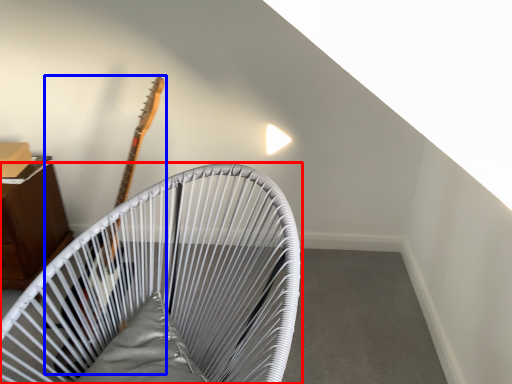
Question: Which object is closer to the camera taking this photo, furniture (highlighted by a red box) or guitar (highlighted by a blue box)?

Choices:
 (A) furniture
 (B) guitar

Answer: (A)